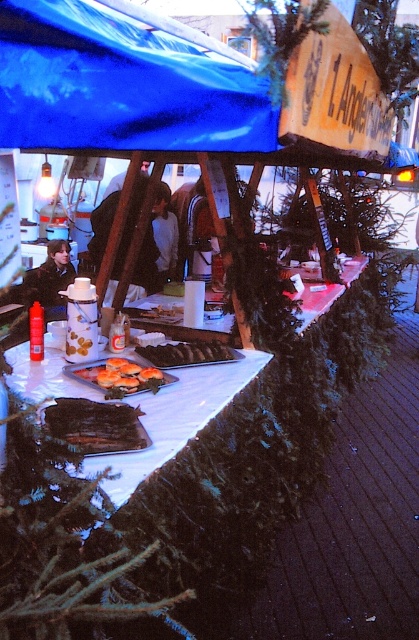
You are at the market stall and want to buy the golden brown pastry at center. The vendor tells you that the pastry is located at point coordinates of (121, 376). Can you confirm if this point is indeed on the golden brown pastry at center?

Yes, the point at coordinates (121, 376) is on the golden brown pastry at center, so the vendor is correct.

You are a customer at the market stall and want to order the golden brown pastry at center and the brown wooden skewers at center. Which item is located to the left of the other?

The golden brown pastry at center is positioned on the left side of brown wooden skewers at center.